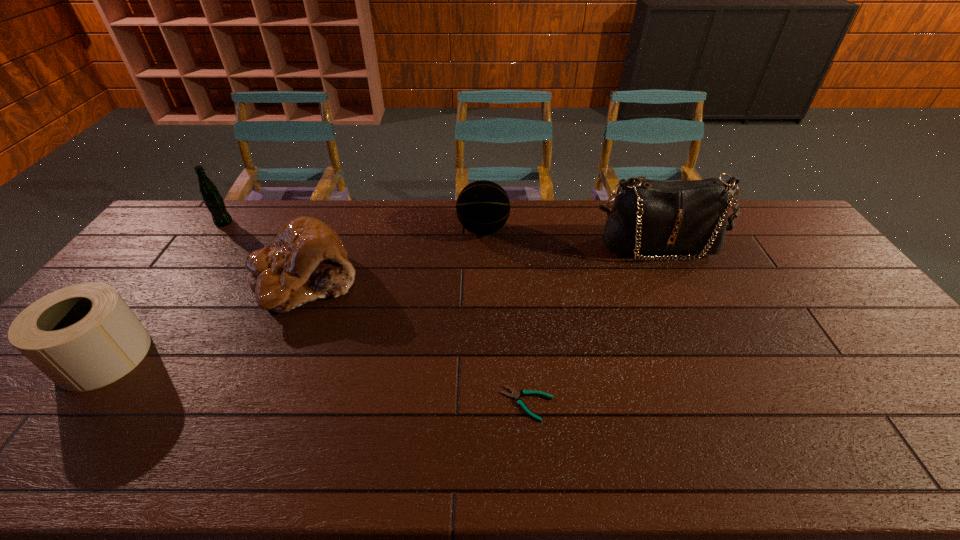
The height and width of the screenshot is (540, 960). I want to click on empty space that is in between the pliers and the fourth object from right to left, so click(x=417, y=342).

You are a GUI agent. You are given a task and a screenshot of the screen. Output one action in this format:
    pyautogui.click(x=<x>, y=<y>)
    Task: Click on the vacant point located between the second tallest object and the handbag
    The image size is (960, 540).
    Given the screenshot: What is the action you would take?
    pyautogui.click(x=440, y=234)

Identify the location of vacant area that lies between the handbag and the fifth shortest object. (440, 234).

Identify the location of vacant area that lies between the beer bottle and the shortest object. This screenshot has width=960, height=540. (375, 313).

Image resolution: width=960 pixels, height=540 pixels. Identify the location of vacant space in between the shortest object and the bread. (417, 342).

The height and width of the screenshot is (540, 960). In order to click on free space between the second tallest object and the basketball in this screenshot , I will do `click(353, 226)`.

Locate which object ranks second in proximity to the tallest object. Please provide its 2D coordinates. Your answer should be formatted as a tuple, i.e. [(x, y)], where the tuple contains the x and y coordinates of a point satisfying the conditions above.

[(515, 394)]

Locate an element on the screen. object that is the second closest to the basketball is located at coordinates (307, 261).

Identify the location of vacant space that satisfies the following two spatial constraints: 1. on the back side of the fifth shortest object; 2. on the left side of the toilet tissue. The height and width of the screenshot is (540, 960). (206, 222).